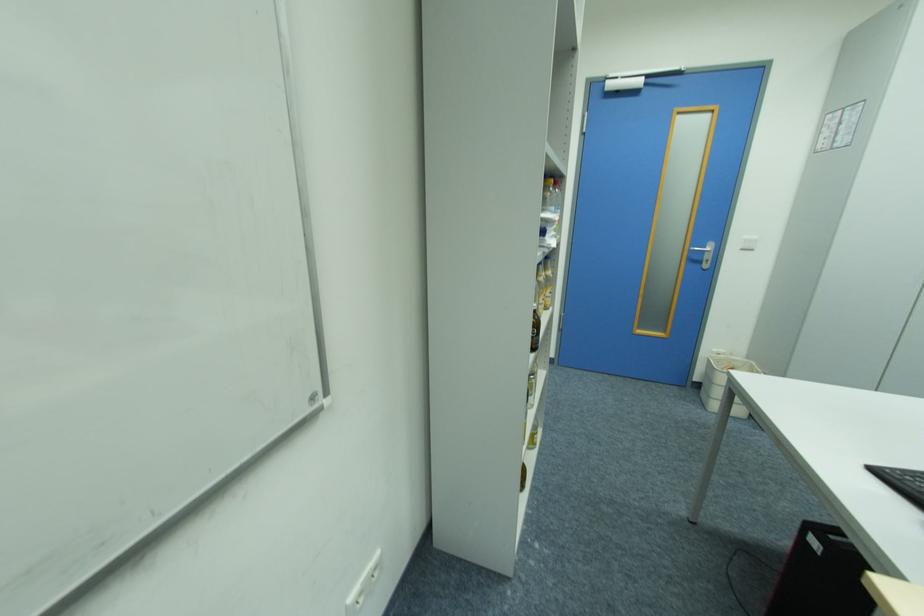
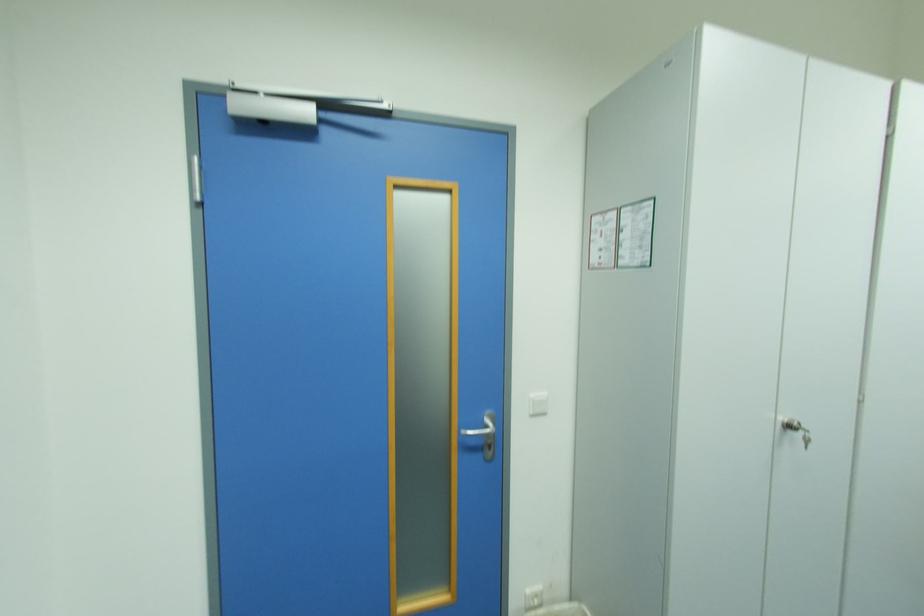
In the second image, find the point that corresponds to point 722,352 in the first image.

(535, 592)